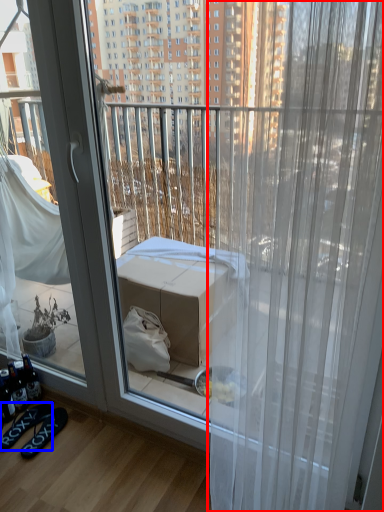
Question: Which point is closer to the camera, curtain (highlighted by a red box) or footwear (highlighted by a blue box)?

Choices:
 (A) curtain
 (B) footwear

Answer: (A)